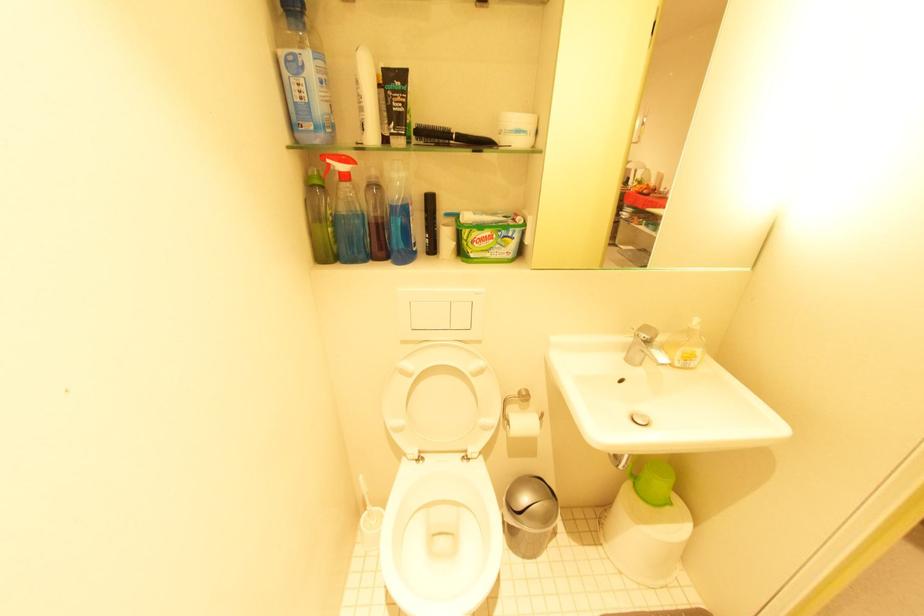
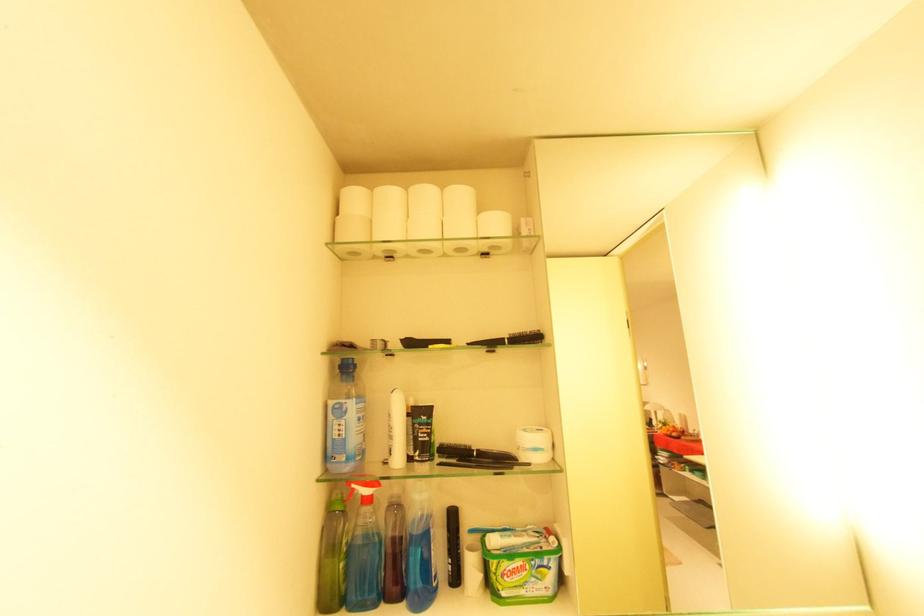
Locate, in the second image, the point that corresponds to the point at 396,262 in the first image.

(410, 605)